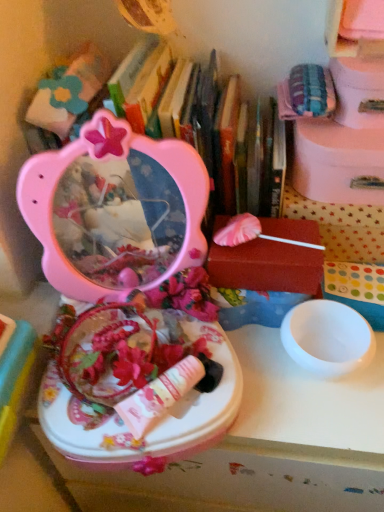
Question: Does pink cardboard box at upper right, acting as the 3th storage box starting from the bottom, come in front of white polka dot fabric at upper right, arranged as the third storage box when viewed from the top?

Choices:
 (A) no
 (B) yes

Answer: (B)

Question: Are pink cardboard box at upper right, the 2th storage box viewed from the top, and white polka dot fabric at upper right, the second storage box when ordered from bottom to top, far apart?

Choices:
 (A) no
 (B) yes

Answer: (A)

Question: Can you confirm if pink cardboard box at upper right, acting as the 3th storage box starting from the bottom, is shorter than white polka dot fabric at upper right, the second storage box when ordered from bottom to top?

Choices:
 (A) no
 (B) yes

Answer: (B)

Question: Is pink cardboard box at upper right, the 2th storage box viewed from the top, turned away from white polka dot fabric at upper right, arranged as the third storage box when viewed from the top?

Choices:
 (A) no
 (B) yes

Answer: (A)

Question: Is pink cardboard box at upper right, the 2th storage box viewed from the top, taller than white polka dot fabric at upper right, the second storage box when ordered from bottom to top?

Choices:
 (A) yes
 (B) no

Answer: (B)

Question: Considering the positions of pink cardboard box at upper right, the 2th storage box viewed from the top, and pink matte lollipop at center, which ranks as the first storage box in bottom-to-top order, in the image, is pink cardboard box at upper right, the 2th storage box viewed from the top, wider or thinner than pink matte lollipop at center, which ranks as the first storage box in bottom-to-top order,?

Choices:
 (A) thin
 (B) wide

Answer: (B)

Question: Considering the positions of pink cardboard box at upper right, the 2th storage box viewed from the top, and pink matte lollipop at center, which ranks as the 4th storage box in top-to-bottom order, in the image, is pink cardboard box at upper right, the 2th storage box viewed from the top, taller or shorter than pink matte lollipop at center, which ranks as the 4th storage box in top-to-bottom order,?

Choices:
 (A) short
 (B) tall

Answer: (A)

Question: From a real-world perspective, relative to pink matte lollipop at center, which ranks as the first storage box in bottom-to-top order, is pink cardboard box at upper right, the 2th storage box viewed from the top, vertically above or below?

Choices:
 (A) above
 (B) below

Answer: (A)

Question: From the image's perspective, is pink cardboard box at upper right, the 2th storage box viewed from the top, above or below pink matte lollipop at center, which ranks as the 4th storage box in top-to-bottom order?

Choices:
 (A) above
 (B) below

Answer: (A)

Question: Looking at the image, does white polka dot fabric at upper right, arranged as the third storage box when viewed from the top, seem bigger or smaller compared to pink plastic mirror at upper left?

Choices:
 (A) small
 (B) big

Answer: (A)

Question: Looking at their shapes, would you say white polka dot fabric at upper right, arranged as the third storage box when viewed from the top, is wider or thinner than pink plastic mirror at upper left?

Choices:
 (A) wide
 (B) thin

Answer: (B)

Question: Is white polka dot fabric at upper right, the second storage box when ordered from bottom to top, in front of or behind pink plastic mirror at upper left in the image?

Choices:
 (A) behind
 (B) front

Answer: (A)

Question: Is white polka dot fabric at upper right, the second storage box when ordered from bottom to top, to the left or to the right of pink plastic mirror at upper left in the image?

Choices:
 (A) left
 (B) right

Answer: (B)

Question: From their relative heights in the image, would you say matte pink vanity at center is taller or shorter than white polka dot fabric at upper right, the second storage box when ordered from bottom to top?

Choices:
 (A) short
 (B) tall

Answer: (A)

Question: Is matte pink vanity at center situated inside white polka dot fabric at upper right, arranged as the third storage box when viewed from the top, or outside?

Choices:
 (A) outside
 (B) inside

Answer: (A)